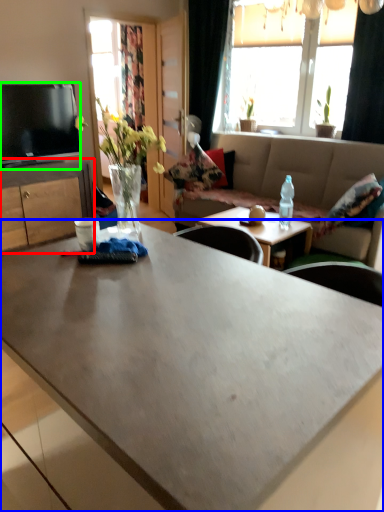
Question: Based on their relative distances, which object is nearer to cabinetry (highlighted by a red box)? Choose from coffee table (highlighted by a blue box) and television (highlighted by a green box).

Choices:
 (A) coffee table
 (B) television

Answer: (B)